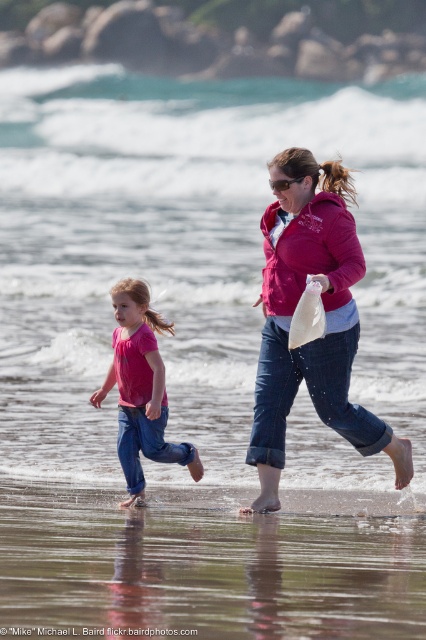
Does clear water at lower center have a greater width compared to matte pink hoodie at center?

Correct, the width of clear water at lower center exceeds that of matte pink hoodie at center.

Between clear water at lower center and matte pink hoodie at center, which one appears on the right side from the viewer's perspective?

clear water at lower center is more to the right.

Find the location of a particular element. This screenshot has height=640, width=426. clear water at lower center is located at coordinates (189, 250).

Locate an element on the screen. matte pink hoodie at center is located at coordinates (325, 316).

Who is positioned more to the right, matte pink hoodie at center or matte pink jacket at center?

From the viewer's perspective, matte pink hoodie at center appears more on the right side.

I want to click on matte pink hoodie at center, so click(325, 316).

The image size is (426, 640). I want to click on matte pink hoodie at center, so (325, 316).

Between point (210, 333) and point (135, 480), which one is positioned behind?

The point (210, 333) is behind.

Can you confirm if clear water at lower center is positioned above pink matte shirt at center?

Yes.

Is point (20, 369) more distant than point (161, 381)?

Yes, it is behind point (161, 381).

Identify the location of clear water at lower center. [x=189, y=250].